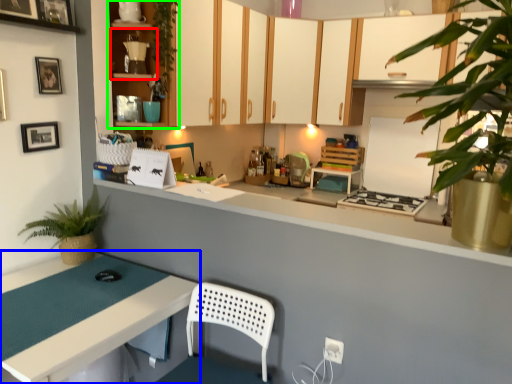
Question: Considering the real-world distances, which object is closest to shelf (highlighted by a red box)? table (highlighted by a blue box) or cabinetry (highlighted by a green box).

Choices:
 (A) table
 (B) cabinetry

Answer: (B)